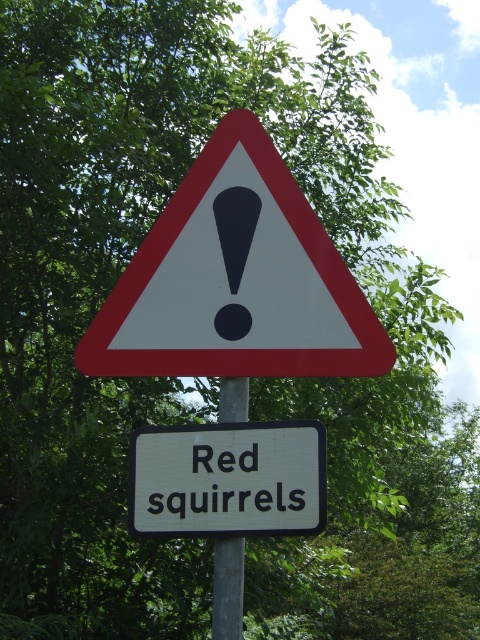
Which of these two, white paper triangle at center or gray metallic pole at center, stands shorter?

gray metallic pole at center

Can you confirm if white paper triangle at center is positioned to the right of gray metallic pole at center?

In fact, white paper triangle at center is to the left of gray metallic pole at center.

I want to click on white paper triangle at center, so click(237, 280).

I want to click on white paper triangle at center, so click(237, 280).

Is white painted rectangular at center above gray metallic pole at center?

Correct, white painted rectangular at center is located above gray metallic pole at center.

Does point (300, 452) lie in front of point (235, 385)?

Yes.

Identify the location of white painted rectangular at center. Image resolution: width=480 pixels, height=640 pixels. (228, 480).

Which is below, white paper triangle at center or white painted rectangular at center?

white painted rectangular at center

Who is higher up, white paper triangle at center or white painted rectangular at center?

white paper triangle at center is higher up.

Identify the location of white paper triangle at center. The image size is (480, 640). (237, 280).